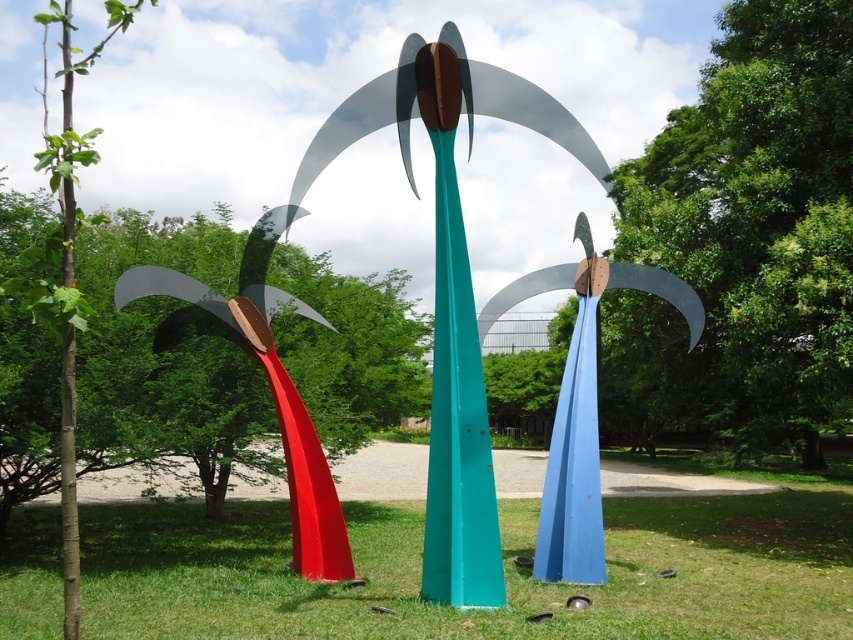
You are standing in the middle of the grassy area and want to find the teal glossy pole at center. Based on the coordinates provided, in which direction should you move to locate it?

The teal glossy pole at center is located at coordinates point (x=457, y=420), which means you should move towards the center of the image to find it.

You are planning to install a new sculpture in this outdoor space. The new sculpture will be placed between the metallic red palm tree at left and the teal glossy pole at center. If the new sculpture must be shorter than both existing sculptures, which one should it be shorter than?

The new sculpture must be shorter than both the metallic red palm tree at left and the teal glossy pole at center. Since the metallic red palm tree at left is taller than the teal glossy pole at center, the new sculpture must be shorter than the metallic red palm tree at left to satisfy both conditions.

You are standing in the outdoor area and want to take a photo of the teal glossy pole at center without the metallic red palm tree at left blocking it. How should you position yourself relative to the two objects?

Move to the right side of the teal glossy pole at center so that the metallic red palm tree at left is no longer in front of it. Since the metallic red palm tree at left is in front of the teal glossy pole at center, positioning yourself to the right of the teal glossy pole at center will allow you to capture it without obstruction.